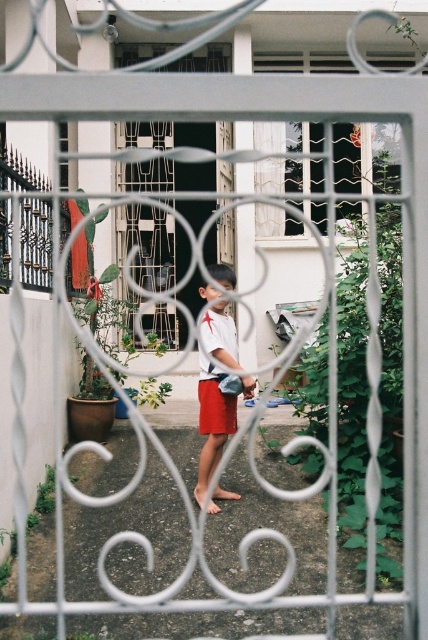
Is white matte shirt at center above red cotton shorts at center?

Yes.

Who is shorter, white matte shirt at center or red cotton shorts at center?

Standing shorter between the two is red cotton shorts at center.

Measure the distance between point (214, 323) and camera.

Point (214, 323) and camera are 4.26 meters apart from each other.

The image size is (428, 640). I want to click on white matte shirt at center, so click(x=214, y=392).